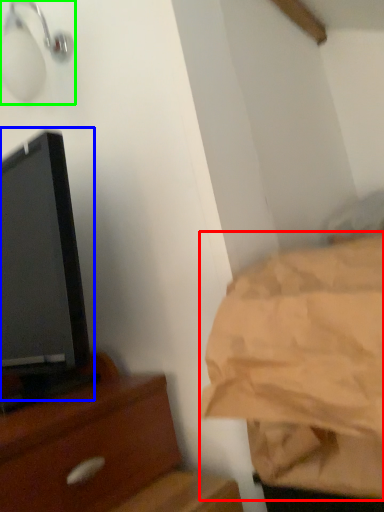
Question: Which object is the farthest from sheet (highlighted by a red box)? Choose among these: tv show (highlighted by a blue box) or light fixture (highlighted by a green box).

Choices:
 (A) tv show
 (B) light fixture

Answer: (B)